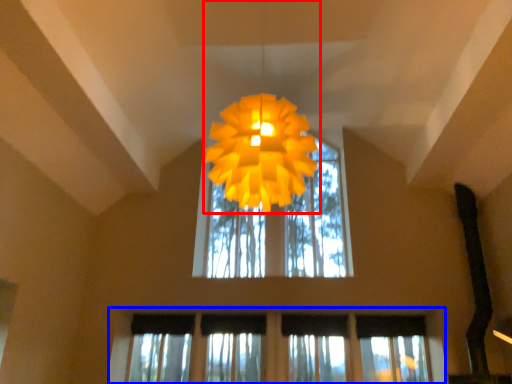
Question: Which of the following is the closest to the observer, lamp (highlighted by a red box) or window (highlighted by a blue box)?

Choices:
 (A) lamp
 (B) window

Answer: (A)